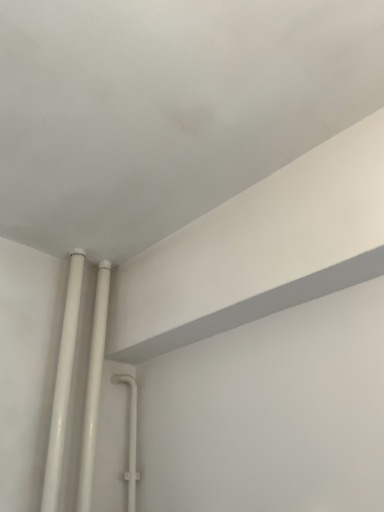
Question: Is white glossy pipes at lower left, the second pipe in the right-to-left sequence, spatially inside white glossy pipes at lower left, which ranks as the second pipe in left-to-right order, or outside of it?

Choices:
 (A) inside
 (B) outside

Answer: (B)

Question: Considering the positions of point (61, 470) and point (87, 401), is point (61, 470) closer or farther from the camera than point (87, 401)?

Choices:
 (A) closer
 (B) farther

Answer: (A)

Question: From the image's perspective, is white glossy pipes at lower left, the second pipe in the right-to-left sequence, located above or below white glossy pipes at lower left, the first pipe when ordered from right to left?

Choices:
 (A) above
 (B) below

Answer: (A)

Question: Does point (94, 453) appear closer or farther from the camera than point (79, 272)?

Choices:
 (A) farther
 (B) closer

Answer: (B)

Question: Is white glossy pipes at lower left, which ranks as the second pipe in left-to-right order, inside the boundaries of white glossy pipes at lower left, the second pipe in the right-to-left sequence, or outside?

Choices:
 (A) inside
 (B) outside

Answer: (B)

Question: Looking at their shapes, would you say white glossy pipes at lower left, which ranks as the second pipe in left-to-right order, is wider or thinner than white glossy pipes at lower left, arranged as the first pipe when viewed from the left?

Choices:
 (A) wide
 (B) thin

Answer: (A)

Question: From the image's perspective, is white glossy pipes at lower left, which ranks as the second pipe in left-to-right order, above or below white glossy pipes at lower left, arranged as the first pipe when viewed from the left?

Choices:
 (A) below
 (B) above

Answer: (A)